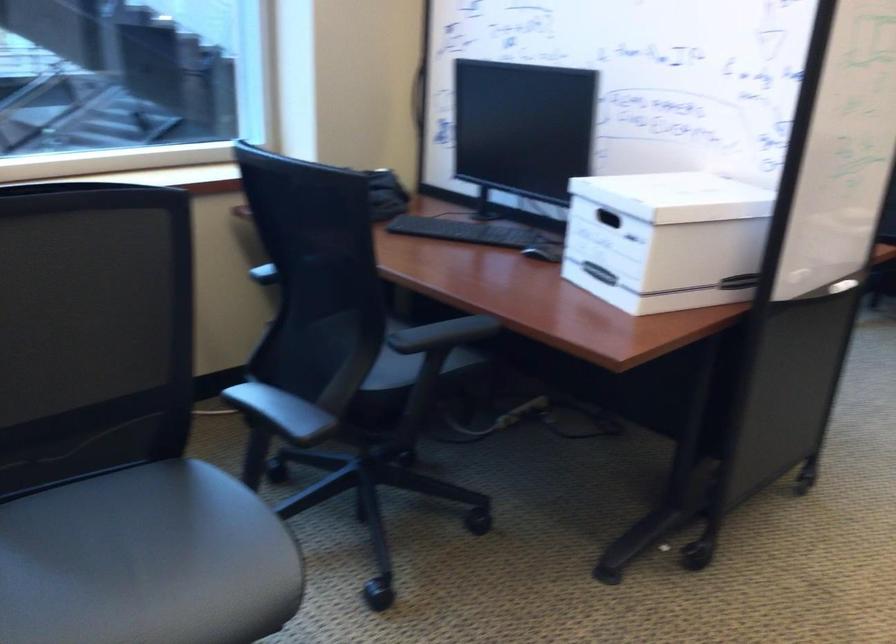
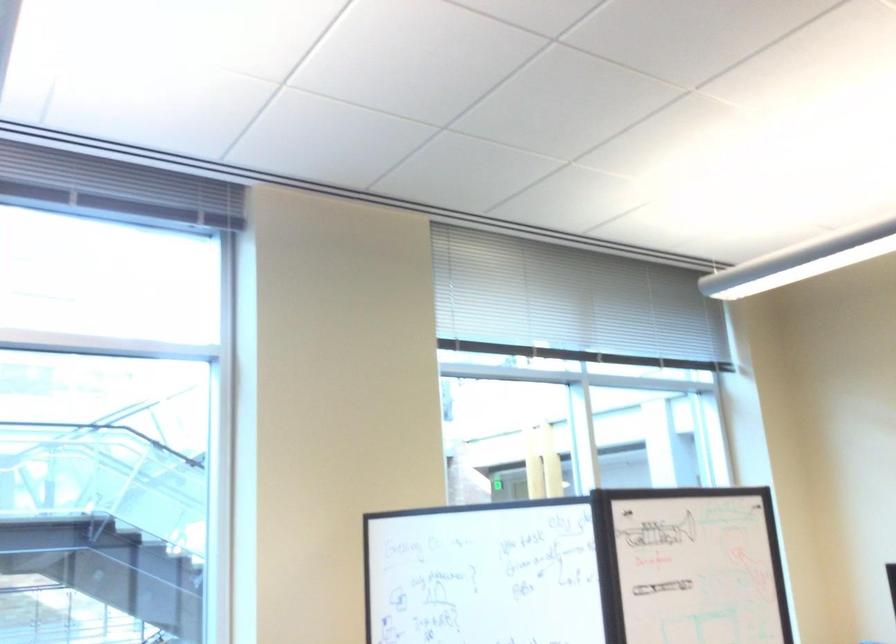
Question: How did the camera likely rotate?

Choices:
 (A) Left
 (B) Right
 (C) Up
 (D) Down

Answer: (C)